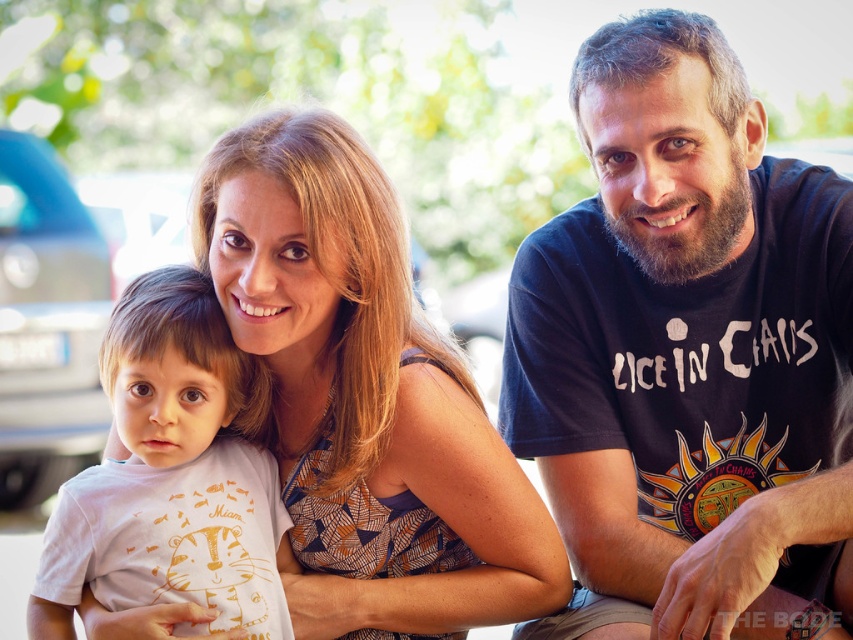
Question: Which of the following is the farthest from the observer?

Choices:
 (A) (270, 292)
 (B) (732, 557)
 (C) (233, 355)

Answer: (C)

Question: Can you confirm if dark blue t-shirt at right is positioned to the right of matte white shirt at center?

Choices:
 (A) yes
 (B) no

Answer: (A)

Question: Which point is farther to the camera?

Choices:
 (A) dark blue t-shirt at right
 (B) white cotton shirt at left

Answer: (B)

Question: Which object appears closest to the camera in this image?

Choices:
 (A) white cotton shirt at left
 (B) matte white shirt at center
 (C) dark blue t-shirt at right

Answer: (C)

Question: Considering the relative positions of matte white shirt at center and white cotton shirt at left in the image provided, where is matte white shirt at center located with respect to white cotton shirt at left?

Choices:
 (A) above
 (B) below

Answer: (A)

Question: Does matte white shirt at center appear on the left side of white cotton shirt at left?

Choices:
 (A) yes
 (B) no

Answer: (B)